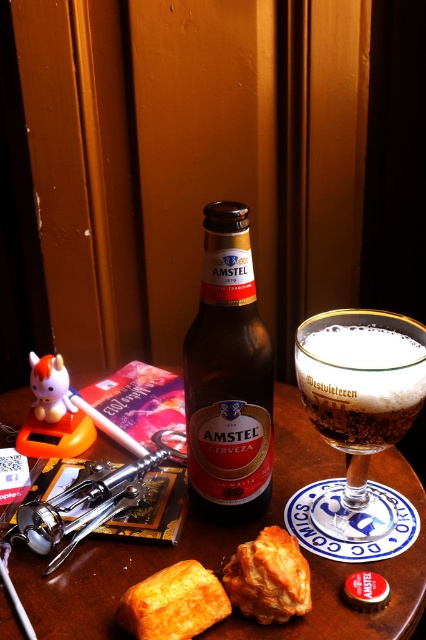
Is point (72, 529) positioned behind point (244, 545)?

Yes, it is behind point (244, 545).

The width and height of the screenshot is (426, 640). I want to click on satin silver metal corkscrew at lower left, so click(x=81, y=506).

Can you confirm if wooden table at center is shorter than amber glass bottle at center?

Yes, wooden table at center is shorter than amber glass bottle at center.

Does point (285, 486) come closer to viewer compared to point (192, 388)?

That is False.

You are a GUI agent. You are given a task and a screenshot of the screen. Output one action in this format:
    pyautogui.click(x=<x>, y=<y>)
    Task: Click on the wooden table at center
    The height and width of the screenshot is (640, 426).
    Given the screenshot: What is the action you would take?
    pyautogui.click(x=163, y=547)

Is point (351, 506) in front of point (259, 620)?

No, it is behind (259, 620).

Which is in front, point (336, 496) or point (290, 602)?

Point (290, 602)

From the picture: Measure the distance between point [348,332] and camera.

Point [348,332] is 46.69 centimeters from camera.

Where is `foamy amber liquid at center`? The height and width of the screenshot is (640, 426). foamy amber liquid at center is located at coordinates (359, 404).